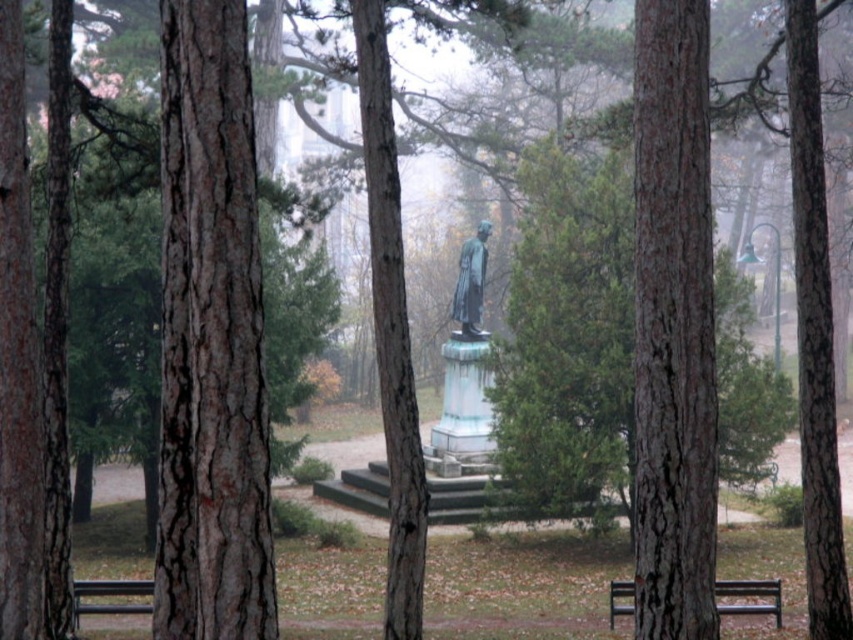
Question: Does bronze statue at center appear over black metal bench at lower left?

Choices:
 (A) no
 (B) yes

Answer: (B)

Question: Is smooth bark tree at center above black wooden bench at center?

Choices:
 (A) yes
 (B) no

Answer: (A)

Question: Is the position of smooth brown bark at center more distant than that of black wooden bench at center?

Choices:
 (A) yes
 (B) no

Answer: (B)

Question: Which is farther from the smooth brown bark at center?

Choices:
 (A) brown rough bark tree trunk at left
 (B) black wooden bench at center
 (C) black metal bench at lower left

Answer: (C)

Question: Which of the following is the farthest from the observer?

Choices:
 (A) brown rough bark tree trunk at left
 (B) black metal bench at lower left
 (C) bronze statue at center

Answer: (C)

Question: Among these objects, which one is farthest from the camera?

Choices:
 (A) bronze statue at center
 (B) black wooden bench at center
 (C) brown rough bark tree trunk at left
 (D) smooth brown bark at center

Answer: (A)